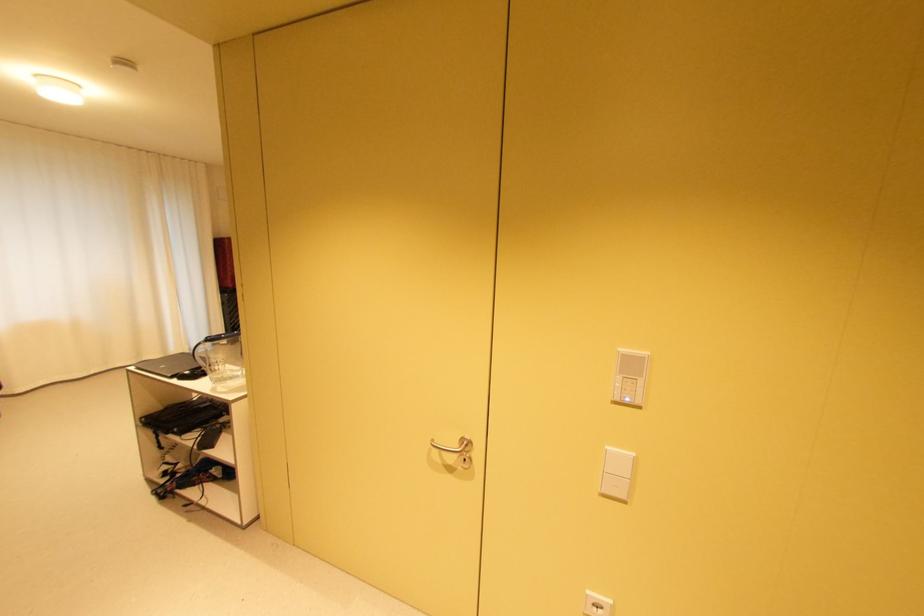
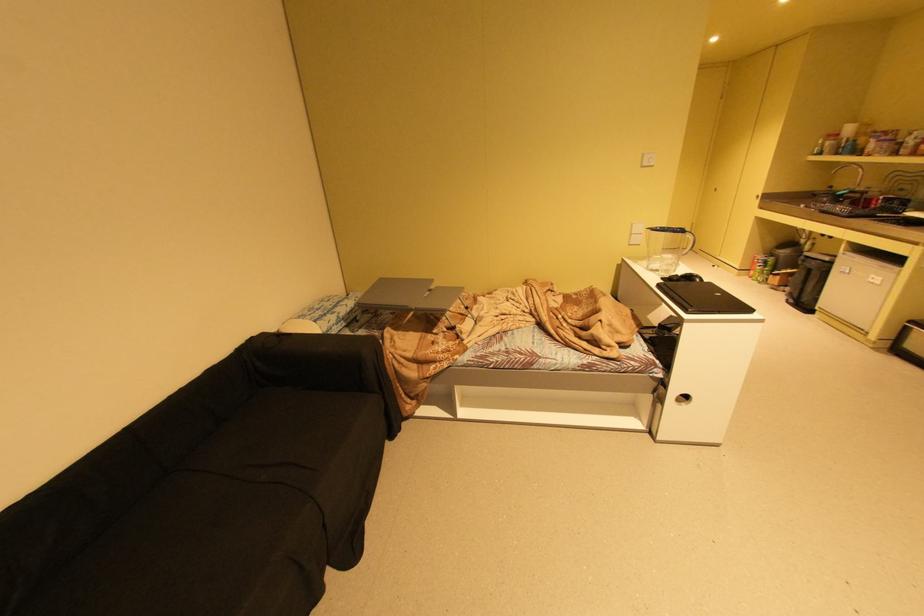
In the second image, find the point that corresponds to the point at 171,367 in the first image.

(726, 294)